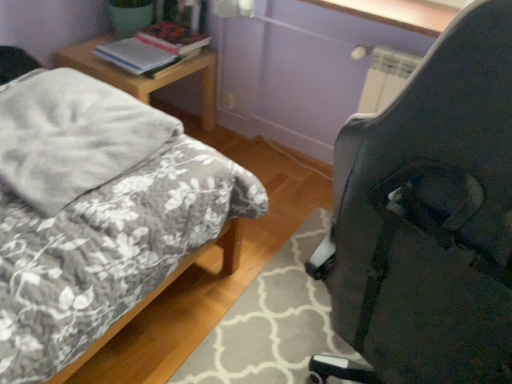
At what (x,y) coordinates should I click in order to perform the action: click on hardcover book at upper left, marked as the first book in a back-to-front arrangement. Please return your answer as a coordinate pair (x, y). Looking at the image, I should click on (172, 38).

Image resolution: width=512 pixels, height=384 pixels. I want to click on floral-patterned fabric bed at left, so click(x=96, y=212).

In order to face woodennightstand at left, should I rotate leftwards or rightwards?

A 14.824 degree turn to the left will do.

The height and width of the screenshot is (384, 512). What do you see at coordinates (397, 13) in the screenshot? I see `white glossy window sill at upper center` at bounding box center [397, 13].

Where is `hardcover book at upper left, which appears as the second book when viewed from the front`? The height and width of the screenshot is (384, 512). hardcover book at upper left, which appears as the second book when viewed from the front is located at coordinates (172, 38).

Between hardcover book at upper left, marked as the first book in a back-to-front arrangement, and floral-patterned fabric bed at left, which one appears on the left side from the viewer's perspective?

floral-patterned fabric bed at left.

Which of these two, hardcover book at upper left, marked as the first book in a back-to-front arrangement, or floral-patterned fabric bed at left, is wider?

Wider between the two is floral-patterned fabric bed at left.

Can you confirm if floral-patterned fabric bed at left is thinner than white glossy window sill at upper center?

Incorrect, the width of floral-patterned fabric bed at left is not less than that of white glossy window sill at upper center.

Is floral-patterned fabric bed at left spatially inside white glossy window sill at upper center, or outside of it?

floral-patterned fabric bed at left lies outside white glossy window sill at upper center.

Does floral-patterned fabric bed at left turn towards white glossy window sill at upper center?

Yes, floral-patterned fabric bed at left is facing white glossy window sill at upper center.

Can you tell me how much gray soft blanket at left and hardcover book at upper left, marked as the first book in a back-to-front arrangement, differ in facing direction?

92.2 degrees.

From a real-world perspective, is gray soft blanket at left below hardcover book at upper left, which appears as the second book when viewed from the front?

No.

The width and height of the screenshot is (512, 384). In order to click on the 2nd book behind when counting from the gray soft blanket at left in this screenshot , I will do `click(172, 38)`.

Visually, is gray soft blanket at left positioned to the left or to the right of hardcover book at upper left, marked as the first book in a back-to-front arrangement?

In the image, gray soft blanket at left appears on the left side of hardcover book at upper left, marked as the first book in a back-to-front arrangement.

Which is closer to the camera, (381, 17) or (97, 121)?

Point (381, 17) is positioned farther from the camera compared to point (97, 121).

Which of these two, white glossy window sill at upper center or gray soft blanket at left, stands shorter?

Standing shorter between the two is white glossy window sill at upper center.

Looking at this image, is white glossy window sill at upper center not close to gray soft blanket at left?

white glossy window sill at upper center is far away from gray soft blanket at left.

Is woodennightstand at left far from hardcover book at upper left, which appears as the second book when viewed from the front?

woodennightstand at left is actually quite close to hardcover book at upper left, which appears as the second book when viewed from the front.

Is woodennightstand at left to the right of hardcover book at upper left, which appears as the second book when viewed from the front, from the viewer's perspective?

Incorrect, woodennightstand at left is not on the right side of hardcover book at upper left, which appears as the second book when viewed from the front.

Does woodennightstand at left turn towards hardcover book at upper left, which appears as the second book when viewed from the front?

No, woodennightstand at left is not aimed at hardcover book at upper left, which appears as the second book when viewed from the front.

Which point is more distant from viewer, (111, 66) or (148, 30)?

Positioned behind is point (148, 30).

Is black plastic chair at right looking in the opposite direction of white paper stack at upper left, the 1th book viewed from the front?

No, black plastic chair at right's orientation is not away from white paper stack at upper left, the 1th book viewed from the front.

Is point (498, 269) positioned in front of point (106, 58)?

That is True.

Can you confirm if black plastic chair at right is positioned to the left of white paper stack at upper left, arranged as the second book when viewed from the back?

No.

Considering the sizes of black plastic chair at right and white paper stack at upper left, the 1th book viewed from the front, in the image, is black plastic chair at right wider or thinner than white paper stack at upper left, the 1th book viewed from the front,?

In the image, black plastic chair at right appears to be wider than white paper stack at upper left, the 1th book viewed from the front.

Is point (197, 45) behind point (106, 78)?

Yes, point (197, 45) is behind point (106, 78).

In the scene shown: From a real-world perspective, who is located lower, hardcover book at upper left, marked as the first book in a back-to-front arrangement, or woodennightstand at left?

woodennightstand at left.

Is hardcover book at upper left, which appears as the second book when viewed from the front, wider or thinner than woodennightstand at left?

In the image, hardcover book at upper left, which appears as the second book when viewed from the front, appears to be more narrow than woodennightstand at left.

The image size is (512, 384). Find the location of `the 2nd book behind the floral-patterned fabric bed at left`. the 2nd book behind the floral-patterned fabric bed at left is located at coordinates (172, 38).

Identify the location of bed on the left of the white glossy window sill at upper center. (96, 212).

Based on their spatial positions, is hardcover book at upper left, which appears as the second book when viewed from the front, or woodennightstand at left closer to gray soft blanket at left?

Based on the image, woodennightstand at left appears to be nearer to gray soft blanket at left.

Based on their spatial positions, is black plastic chair at right or floral-patterned fabric bed at left closer to white paper stack at upper left, the 1th book viewed from the front?

Based on the image, floral-patterned fabric bed at left appears to be nearer to white paper stack at upper left, the 1th book viewed from the front.

Based on the photo, based on their spatial positions, is black plastic chair at right or white paper stack at upper left, the 1th book viewed from the front, further from hardcover book at upper left, which appears as the second book when viewed from the front?

Based on the image, black plastic chair at right appears to be further to hardcover book at upper left, which appears as the second book when viewed from the front.

Based on their spatial positions, is white paper stack at upper left, arranged as the second book when viewed from the back, or floral-patterned fabric bed at left closer to gray soft blanket at left?

Among the two, floral-patterned fabric bed at left is located nearer to gray soft blanket at left.

Which object lies further to the anchor point hardcover book at upper left, which appears as the second book when viewed from the front, black plastic chair at right or woodennightstand at left?

black plastic chair at right is positioned further to the anchor hardcover book at upper left, which appears as the second book when viewed from the front.

From the image, which object appears to be farther from black plastic chair at right, gray soft blanket at left or white paper stack at upper left, arranged as the second book when viewed from the back?

white paper stack at upper left, arranged as the second book when viewed from the back, is positioned further to the anchor black plastic chair at right.

From the image, which object appears to be farther from white paper stack at upper left, the 1th book viewed from the front, black plastic chair at right or gray soft blanket at left?

The object further to white paper stack at upper left, the 1th book viewed from the front, is black plastic chair at right.

When comparing their distances from floral-patterned fabric bed at left, does hardcover book at upper left, which appears as the second book when viewed from the front, or white glossy window sill at upper center seem closer?

Among the two, hardcover book at upper left, which appears as the second book when viewed from the front, is located nearer to floral-patterned fabric bed at left.

Where is `book between black plastic chair at right and hardcover book at upper left, which appears as the second book when viewed from the front, in the front-back direction`? The height and width of the screenshot is (384, 512). book between black plastic chair at right and hardcover book at upper left, which appears as the second book when viewed from the front, in the front-back direction is located at coordinates [134, 55].

Locate an element on the screen. pillow between floral-patterned fabric bed at left and white paper stack at upper left, arranged as the second book when viewed from the back, from front to back is located at coordinates 73,136.

At what (x,y) coordinates should I click in order to perform the action: click on window sill between floral-patterned fabric bed at left and hardcover book at upper left, which appears as the second book when viewed from the front, from front to back. Please return your answer as a coordinate pair (x, y). Image resolution: width=512 pixels, height=384 pixels. Looking at the image, I should click on (397, 13).

I want to click on window sill between black plastic chair at right and hardcover book at upper left, marked as the first book in a back-to-front arrangement, along the z-axis, so click(x=397, y=13).